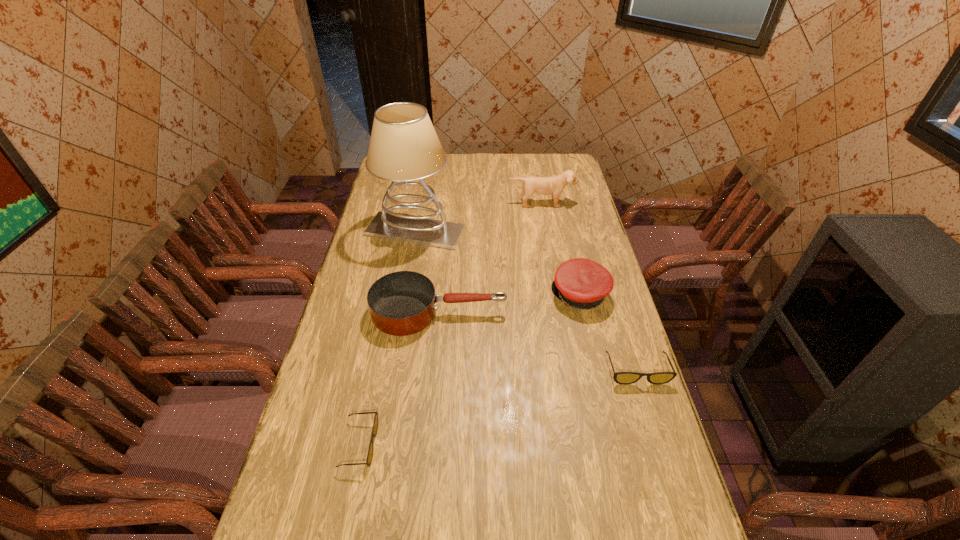
To achieve uniform spacing by inserting another sunglasses among them, please point to a free space for this new sunglasses. Please provide its 2D coordinates. Your answer should be formatted as a tuple, i.e. [(x, y)], where the tuple contains the x and y coordinates of a point satisfying the conditions above.

[(508, 404)]